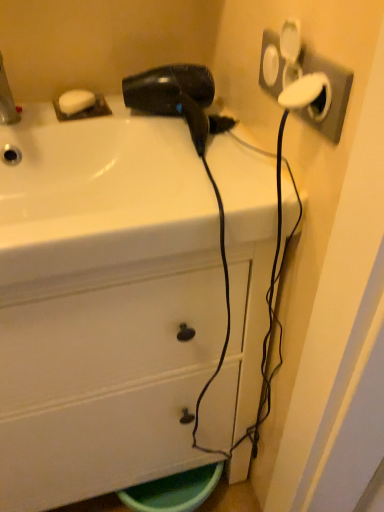
Locate an element on the screen. The width and height of the screenshot is (384, 512). vacant area that lies between white matte soap at upper left and brushed metal faucet at upper left is located at coordinates [x=49, y=120].